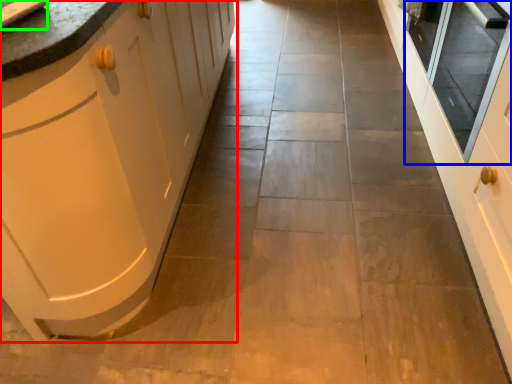
Question: Which object is positioned farthest from cabinetry (highlighted by a red box)? Select from window screen (highlighted by a blue box) and sink (highlighted by a green box).

Choices:
 (A) window screen
 (B) sink

Answer: (A)